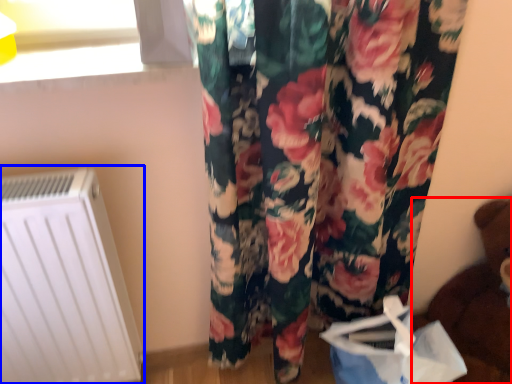
Question: Among these objects, which one is farthest to the camera, toy (highlighted by a red box) or radiator (highlighted by a blue box)?

Choices:
 (A) toy
 (B) radiator

Answer: (B)